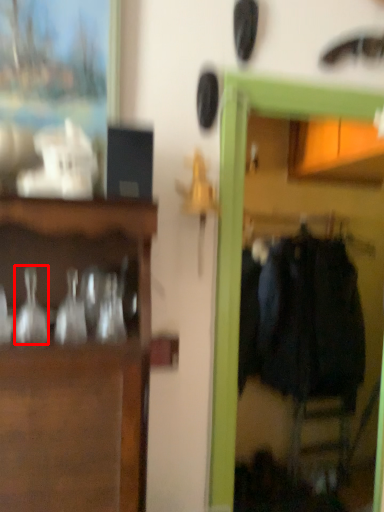
Question: From the image, what is the correct spatial relationship of glass vase (annotated by the red box) in relation to clothing?

Choices:
 (A) left
 (B) right

Answer: (A)